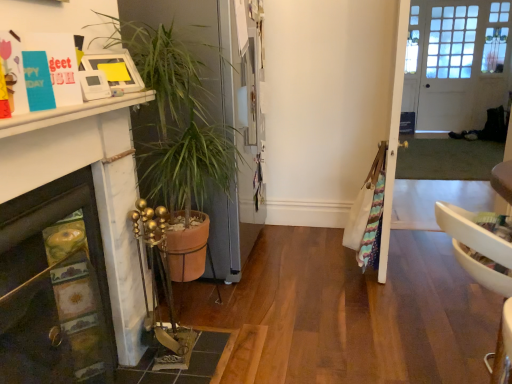
Locate an element on the screen. terracotta pot at left is located at coordinates (189, 113).

What is the approximate width of clear glass door at center?

clear glass door at center is 14.92 inches wide.

This screenshot has height=384, width=512. Find the location of `matte brown tile at lower left`. matte brown tile at lower left is located at coordinates (179, 369).

Between matte brown tile at lower left and marble fireplace at lower left, which one appears on the left side from the viewer's perspective?

marble fireplace at lower left.

Is matte brown tile at lower left facing away from marble fireplace at lower left?

No, matte brown tile at lower left's orientation is not away from marble fireplace at lower left.

Considering the relative sizes of matte brown tile at lower left and marble fireplace at lower left in the image provided, is matte brown tile at lower left bigger than marble fireplace at lower left?

No.

Considering the sizes of objects matte brown tile at lower left and marble fireplace at lower left in the image provided, who is shorter, matte brown tile at lower left or marble fireplace at lower left?

With less height is matte brown tile at lower left.

Which object is more forward, marble fireplace at lower left or matte brown tile at lower left?

marble fireplace at lower left is closer to the camera.

Are marble fireplace at lower left and matte brown tile at lower left located far from each other?

They are positioned close to each other.

In the scene shown: Measure the distance between marble fireplace at lower left and matte brown tile at lower left.

marble fireplace at lower left is 21.49 inches away from matte brown tile at lower left.

Is white wooden door at upper right outside of marble fireplace at lower left?

white wooden door at upper right is positioned outside marble fireplace at lower left.

Is white wooden door at upper right not near marble fireplace at lower left?

That's right, there is a large distance between white wooden door at upper right and marble fireplace at lower left.

From the image's perspective, is white wooden door at upper right on top of marble fireplace at lower left?

Correct, white wooden door at upper right appears higher than marble fireplace at lower left in the image.

Which is nearer, (486, 93) or (64, 336)?

The point (64, 336) is more forward.

Where is `houseplant lying in front of the clear glass door at center`? The width and height of the screenshot is (512, 384). houseplant lying in front of the clear glass door at center is located at coordinates (189, 113).

Based on the photo, is clear glass door at center situated inside terracotta pot at left or outside?

clear glass door at center is outside terracotta pot at left.

Is the depth of clear glass door at center less than that of terracotta pot at left?

No, clear glass door at center is further to the viewer.

Is point (452, 43) farther from viewer compared to point (156, 122)?

That is True.

Is clear glass door at center turned away from marble fireplace at lower left?

No, clear glass door at center is not facing away from marble fireplace at lower left.

Is clear glass door at center at the left side of marble fireplace at lower left?

In fact, clear glass door at center is to the right of marble fireplace at lower left.

Does point (482, 23) appear closer or farther from the camera than point (84, 217)?

Point (482, 23).

This screenshot has height=384, width=512. Find the location of `fireplace that appears in front of the clear glass door at center`. fireplace that appears in front of the clear glass door at center is located at coordinates (54, 289).

From a real-world perspective, is terracotta pot at left over matte brown tile at lower left?

Indeed, from a real-world perspective, terracotta pot at left stands above matte brown tile at lower left.

Where is `tile that is under the terracotta pot at left (from a real-world perspective)`? Image resolution: width=512 pixels, height=384 pixels. tile that is under the terracotta pot at left (from a real-world perspective) is located at coordinates (179, 369).

Which point is more forward, (180, 124) or (176, 376)?

The point (176, 376) is more forward.

Considering the relative positions of terracotta pot at left and matte brown tile at lower left in the image provided, is terracotta pot at left in front of matte brown tile at lower left?

No, terracotta pot at left is further to the viewer.

Considering the positions of point (124, 382) and point (468, 11), is point (124, 382) closer or farther from the camera than point (468, 11)?

Clearly, point (124, 382) is closer to the camera than point (468, 11).

From the image's perspective, would you say matte brown tile at lower left is positioned over white wooden door at upper right?

No, from the image's perspective, matte brown tile at lower left is not on top of white wooden door at upper right.

Looking at their sizes, would you say matte brown tile at lower left is wider or thinner than white wooden door at upper right?

Clearly, matte brown tile at lower left has more width compared to white wooden door at upper right.

Find the location of `door that appears above the matte brown tile at lower left (from the image's perspective)`. door that appears above the matte brown tile at lower left (from the image's perspective) is located at coordinates (457, 62).

At what (x,y) coordinates should I click in order to perform the action: click on tile located behind the marble fireplace at lower left. Please return your answer as a coordinate pair (x, y). The width and height of the screenshot is (512, 384). Looking at the image, I should click on (179, 369).

This screenshot has width=512, height=384. I want to click on tile that appears below the marble fireplace at lower left (from a real-world perspective), so click(179, 369).

When comparing their distances from clear glass door at center, does matte brown tile at lower left or white wooden door at upper right seem closer?

white wooden door at upper right.

Estimate the real-world distances between objects in this image. Which object is further from terracotta pot at left, marble fireplace at lower left or white wooden door at upper right?

white wooden door at upper right.

Considering their positions, is matte brown tile at lower left positioned closer to marble fireplace at lower left than terracotta pot at left?

Based on the image, matte brown tile at lower left appears to be nearer to marble fireplace at lower left.

Considering their positions, is clear glass door at center positioned closer to white wooden door at upper right than terracotta pot at left?

The object closer to white wooden door at upper right is clear glass door at center.

Based on the photo, when comparing their distances from white wooden door at upper right, does terracotta pot at left or matte brown tile at lower left seem further?

Among the two, matte brown tile at lower left is located further to white wooden door at upper right.

Looking at the image, which one is located further to marble fireplace at lower left, terracotta pot at left or clear glass door at center?

clear glass door at center.

Which object lies further to the anchor point white wooden door at upper right, terracotta pot at left or clear glass door at center?

terracotta pot at left lies further to white wooden door at upper right than the other object.

Which object lies further to the anchor point terracotta pot at left, clear glass door at center or matte brown tile at lower left?

clear glass door at center is further to terracotta pot at left.

Where is `tile between marble fireplace at lower left and clear glass door at center from left to right`? This screenshot has width=512, height=384. tile between marble fireplace at lower left and clear glass door at center from left to right is located at coordinates (179, 369).

Where is `houseplant located between matte brown tile at lower left and clear glass door at center in the left-right direction`? This screenshot has width=512, height=384. houseplant located between matte brown tile at lower left and clear glass door at center in the left-right direction is located at coordinates (189, 113).

Where is `houseplant positioned between matte brown tile at lower left and white wooden door at upper right from near to far`? houseplant positioned between matte brown tile at lower left and white wooden door at upper right from near to far is located at coordinates (189, 113).

This screenshot has width=512, height=384. Find the location of `houseplant positioned between marble fireplace at lower left and white wooden door at upper right from near to far`. houseplant positioned between marble fireplace at lower left and white wooden door at upper right from near to far is located at coordinates (189, 113).